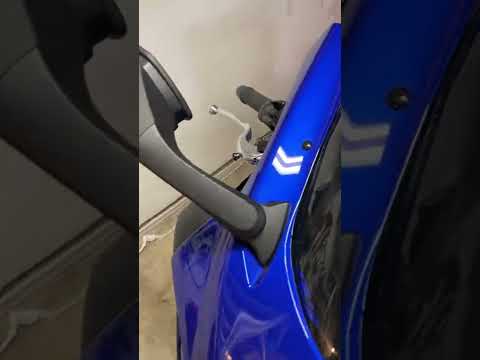
Identify the location of glares from the light. The height and width of the screenshot is (360, 480). (327, 167), (244, 329).